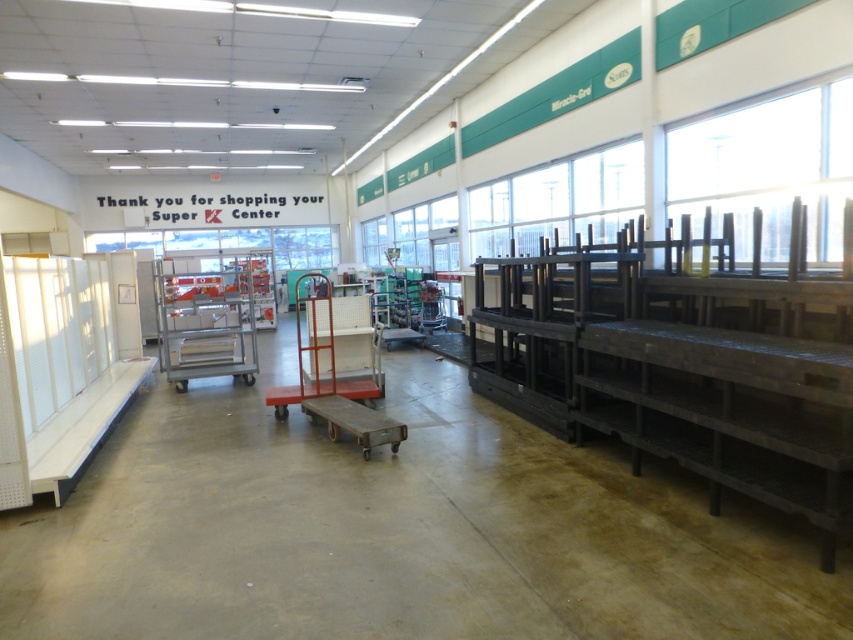
Question: Which point appears farthest from the camera in this image?

Choices:
 (A) (215, 348)
 (B) (370, 340)

Answer: (A)

Question: Which object is farther from the camera taking this photo?

Choices:
 (A) white plastic cart at center
 (B) metallic gray cart at center

Answer: (B)

Question: Can you confirm if metallic gray cart at center is smaller than white plastic cart at center?

Choices:
 (A) yes
 (B) no

Answer: (A)

Question: Is metallic gray cart at center wider than white plastic cart at center?

Choices:
 (A) no
 (B) yes

Answer: (B)

Question: Is metallic gray cart at center further to the viewer compared to white plastic cart at center?

Choices:
 (A) no
 (B) yes

Answer: (B)